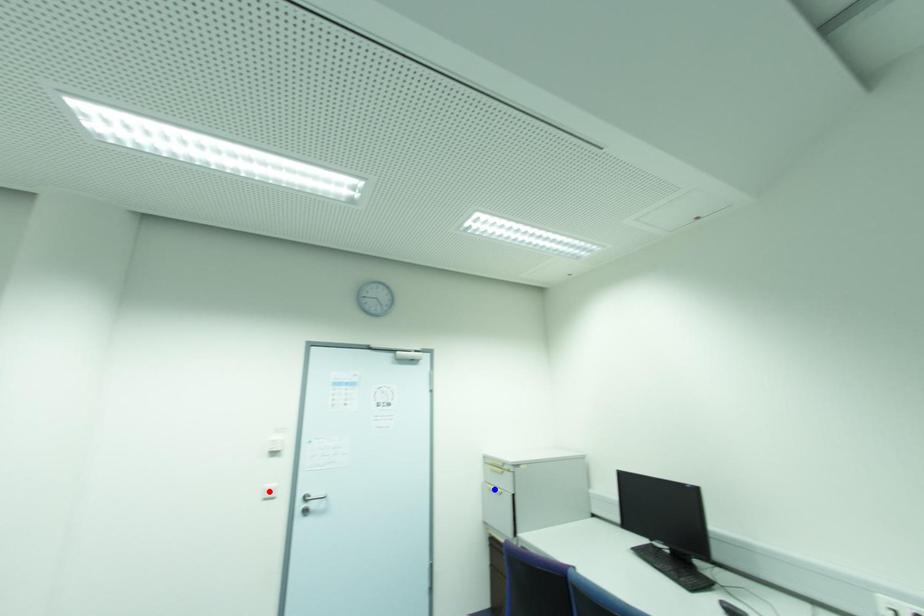
Question: Two points are marked on the image. Which point is closer to the camera?

Choices:
 (A) Blue point is closer.
 (B) Red point is closer.

Answer: (B)